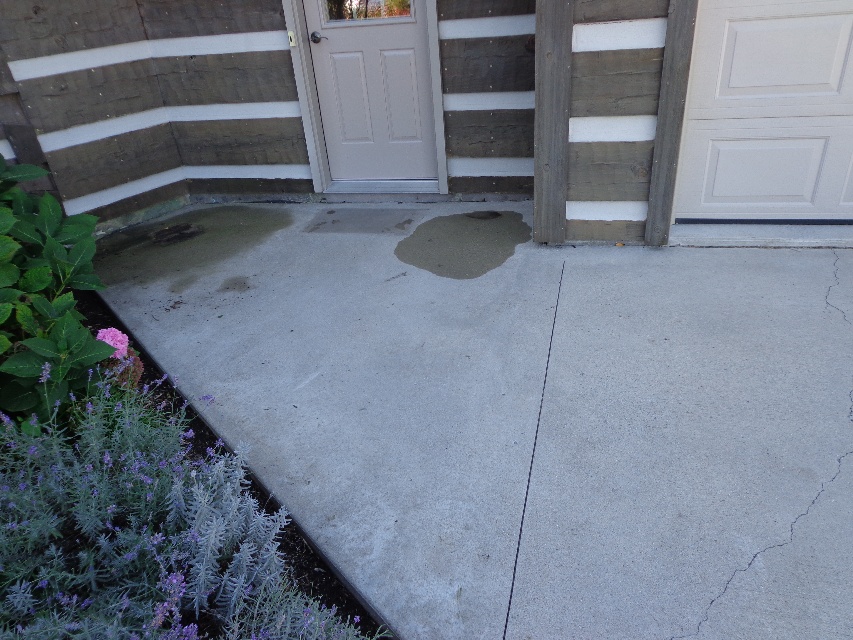
Looking at this image, is white matte door at center above gray concrete crack at center?

Yes, white matte door at center is above gray concrete crack at center.

Does point (379, 13) come behind point (514, 563)?

Yes, it is.

Locate an element on the screen. white matte door at center is located at coordinates (376, 93).

Who is lower down, purple fuzzy plant at lower left or gray concrete crack at center?

purple fuzzy plant at lower left is lower down.

Which is more to the right, purple fuzzy plant at lower left or gray concrete crack at center?

gray concrete crack at center is more to the right.

Describe the element at coordinates (138, 531) in the screenshot. The height and width of the screenshot is (640, 853). I see `purple fuzzy plant at lower left` at that location.

Locate an element on the screen. The width and height of the screenshot is (853, 640). purple fuzzy plant at lower left is located at coordinates (138, 531).

Is concrete wet patch at center further to the viewer compared to purple fuzzy plant at lower left?

Yes, it is behind purple fuzzy plant at lower left.

Measure the distance between concrete wet patch at center and purple fuzzy plant at lower left.

3.19 meters

This screenshot has width=853, height=640. What are the coordinates of `concrete wet patch at center` in the screenshot? It's located at (445, 104).

Find the location of a particular element. This screenshot has height=640, width=853. concrete wet patch at center is located at coordinates (445, 104).